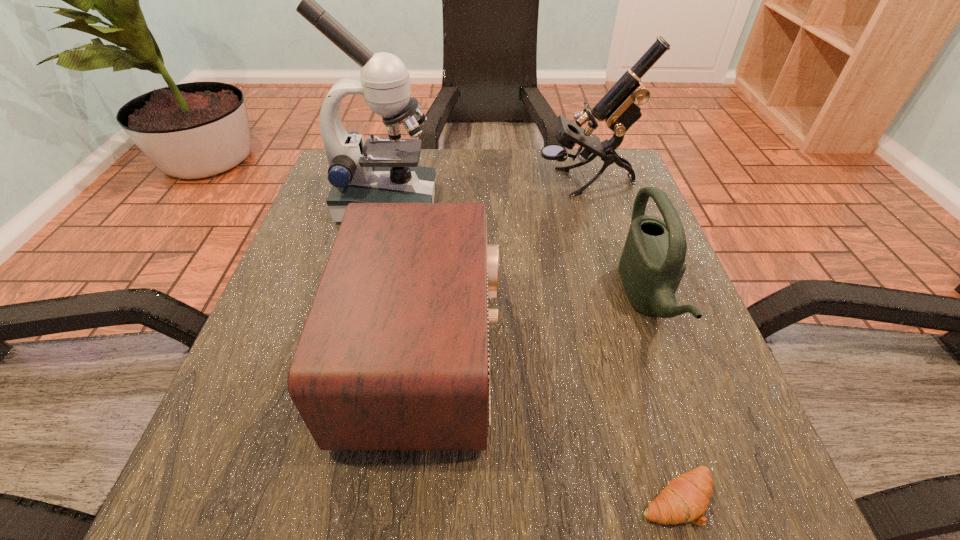
Image resolution: width=960 pixels, height=540 pixels. I want to click on free space between the right microscope and the watering can, so click(615, 241).

Find the location of a particular element. free space between the watering can and the tallest object is located at coordinates click(x=516, y=251).

Locate which object is the third closest to the taller microscope. Please provide its 2D coordinates. Your answer should be formatted as a tuple, i.e. [(x, y)], where the tuple contains the x and y coordinates of a point satisfying the conditions above.

[(652, 264)]

Where is `object that is the second closest to the nearest object`? The height and width of the screenshot is (540, 960). object that is the second closest to the nearest object is located at coordinates (394, 355).

You are a GUI agent. You are given a task and a screenshot of the screen. Output one action in this format:
    pyautogui.click(x=<x>, y=<y>)
    Task: Click on the vacant space that satisfies the following two spatial constraints: 1. on the spout of the watering can; 2. on the front side of the shortest object
    
    Given the screenshot: What is the action you would take?
    pyautogui.click(x=717, y=498)

In order to click on vacant area in the image that satisfies the following two spatial constraints: 1. on the front panel of the radio receiver; 2. on the back side of the crescent roll in this screenshot , I will do `click(409, 498)`.

Identify the location of free space that satisfies the following two spatial constraints: 1. on the spout of the watering can; 2. on the front side of the nearest object. The height and width of the screenshot is (540, 960). (717, 498).

I want to click on vacant area in the image that satisfies the following two spatial constraints: 1. on the back side of the shortest object; 2. on the front panel of the radio receiver, so click(x=635, y=354).